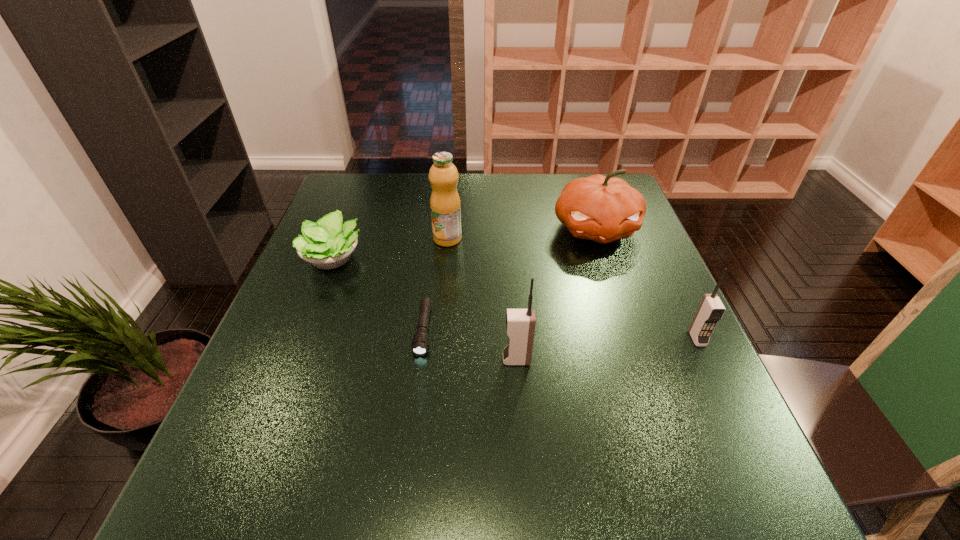
This screenshot has height=540, width=960. In order to click on pumpkin positioned at the right edge in this screenshot , I will do `click(600, 208)`.

This screenshot has width=960, height=540. In order to click on object present at the far right corner in this screenshot , I will do `click(600, 208)`.

The width and height of the screenshot is (960, 540). I want to click on free location at the far edge, so click(x=461, y=174).

Where is `free region at the left edge of the desktop`? free region at the left edge of the desktop is located at coordinates (304, 352).

Image resolution: width=960 pixels, height=540 pixels. In order to click on vacant space at the right edge of the desktop in this screenshot , I will do `click(612, 268)`.

Where is `vacant region at the far left corner of the desktop`? vacant region at the far left corner of the desktop is located at coordinates (353, 197).

In the image, there is a desktop. Where is `free region at the near right corner`? This screenshot has width=960, height=540. free region at the near right corner is located at coordinates (653, 451).

Locate an element on the screen. free space between the farther cellular telephone and the fruit juice is located at coordinates (572, 289).

Find the location of `free space between the pumpkin and the fourth object from left to right`. free space between the pumpkin and the fourth object from left to right is located at coordinates (556, 294).

Locate an element on the screen. The width and height of the screenshot is (960, 540). unoccupied area between the pumpkin and the flashlight is located at coordinates (510, 280).